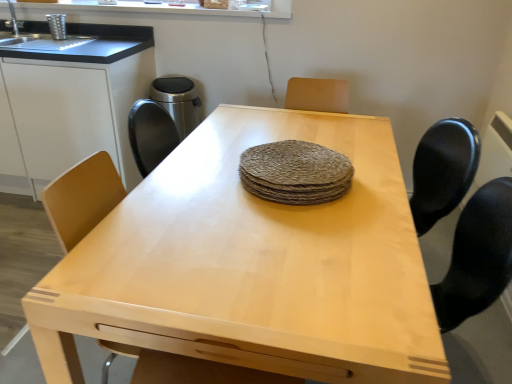
The width and height of the screenshot is (512, 384). What do you see at coordinates (253, 264) in the screenshot?
I see `light wood table at center` at bounding box center [253, 264].

Measure the distance between point (x=307, y=173) and camera.

Point (x=307, y=173) is 1.33 meters away from camera.

Locate an element on the screen. This screenshot has height=384, width=512. light wood table at center is located at coordinates (253, 264).

Based on the photo, which is behind, white matte cabinet at left or light wood table at center?

white matte cabinet at left is behind.

Is white matte cabinet at left at the right side of light wood table at center?

No.

Are white matte cabinet at left and rough woven placemat at center making contact?

white matte cabinet at left and rough woven placemat at center are clearly separated.

Is white matte cabinet at left not within rough woven placemat at center?

That's correct, white matte cabinet at left is outside of rough woven placemat at center.

How distant is white matte cabinet at left from rough woven placemat at center?

A distance of 1.41 meters exists between white matte cabinet at left and rough woven placemat at center.

Does white matte cabinet at left have a lesser width compared to rough woven placemat at center?

In fact, white matte cabinet at left might be wider than rough woven placemat at center.

How different are the orientations of rough woven placemat at center and white matte cabinet at left in degrees?

rough woven placemat at center and white matte cabinet at left are facing 92.1 degrees away from each other.

Who is more distant, rough woven placemat at center or white matte cabinet at left?

white matte cabinet at left is further from the camera.

Is rough woven placemat at center bigger than white matte cabinet at left?

No, rough woven placemat at center is not bigger than white matte cabinet at left.

Is rough woven placemat at center situated inside white matte cabinet at left or outside?

rough woven placemat at center is not inside white matte cabinet at left, it's outside.

Could you tell me if light wood table at center is facing rough woven placemat at center?

No, light wood table at center is not facing towards rough woven placemat at center.

Consider the image. Do you think light wood table at center is within rough woven placemat at center, or outside of it?

light wood table at center is spatially situated outside rough woven placemat at center.

Which is closer to the camera, (x=269, y=144) or (x=267, y=345)?

Point (x=269, y=144) is farther from the camera than point (x=267, y=345).

Is rough woven placemat at center oriented away from light wood table at center?

No, rough woven placemat at center is not facing the opposite direction of light wood table at center.

Looking at this image, from the image's perspective, which one is positioned higher, rough woven placemat at center or light wood table at center?

rough woven placemat at center.

Are light wood table at center and white matte cabinet at left located far from each other?

Yes, light wood table at center is far from white matte cabinet at left.

Which of these two, light wood table at center or white matte cabinet at left, is thinner?

white matte cabinet at left is thinner.

Would you say light wood table at center is to the left or to the right of white matte cabinet at left in the picture?

light wood table at center is to the right of white matte cabinet at left.

Looking at this image, from a real-world perspective, who is located lower, light wood table at center or white matte cabinet at left?

From a 3D spatial view, light wood table at center is below.

Locate an element on the screen. The width and height of the screenshot is (512, 384). cabinetry lying on the left of light wood table at center is located at coordinates (71, 103).

Where is `food lying below the white matte cabinet at left (from the image's perspective)`? The image size is (512, 384). food lying below the white matte cabinet at left (from the image's perspective) is located at coordinates (295, 172).

Looking at the image, which one is located further to light wood table at center, white matte cabinet at left or rough woven placemat at center?

Based on the image, white matte cabinet at left appears to be further to light wood table at center.

From the image, which object appears to be nearer to light wood table at center, rough woven placemat at center or white matte cabinet at left?

rough woven placemat at center lies closer to light wood table at center than the other object.

When comparing their distances from rough woven placemat at center, does light wood table at center or white matte cabinet at left seem further?

white matte cabinet at left is further to rough woven placemat at center.

Based on their spatial positions, is light wood table at center or rough woven placemat at center further from white matte cabinet at left?

rough woven placemat at center lies further to white matte cabinet at left than the other object.

Which object lies further to the anchor point rough woven placemat at center, white matte cabinet at left or light wood table at center?

white matte cabinet at left lies further to rough woven placemat at center than the other object.

Which object lies nearer to the anchor point white matte cabinet at left, rough woven placemat at center or light wood table at center?

light wood table at center lies closer to white matte cabinet at left than the other object.

You are a GUI agent. You are given a task and a screenshot of the screen. Output one action in this format:
    pyautogui.click(x=<x>, y=<y>)
    Task: Click on the table between white matte cabinet at left and rough woven placemat at center
    The image size is (512, 384).
    Given the screenshot: What is the action you would take?
    pyautogui.click(x=253, y=264)